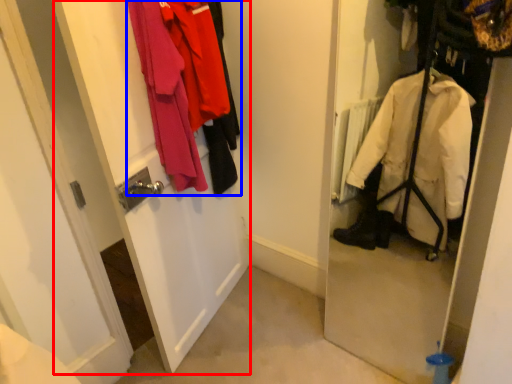
Question: Which point is closer to the camera, screen door (highlighted by a red box) or laundry (highlighted by a blue box)?

Choices:
 (A) screen door
 (B) laundry

Answer: (A)